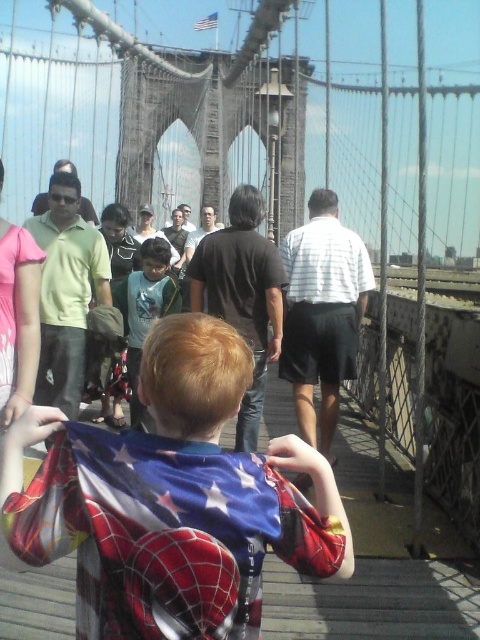
Who is shorter, spiderman costume at center or light blue shirt at center?

light blue shirt at center

Can you confirm if spiderman costume at center is positioned to the right of light blue shirt at center?

Yes, spiderman costume at center is to the right of light blue shirt at center.

Where is `spiderman costume at center`? Image resolution: width=480 pixels, height=640 pixels. spiderman costume at center is located at coordinates (170, 493).

This screenshot has width=480, height=640. What do you see at coordinates (144, 310) in the screenshot?
I see `light blue shirt at center` at bounding box center [144, 310].

Is light blue shirt at center to the left of white fabric flag at upper center from the viewer's perspective?

Correct, you'll find light blue shirt at center to the left of white fabric flag at upper center.

Is point (134, 401) in front of point (202, 28)?

Yes, it is.

Identify the location of light blue shirt at center. This screenshot has height=640, width=480. (144, 310).

Between point (167, 378) and point (213, 17), which one is positioned behind?

Point (213, 17)

Does spiderman costume at center have a lesser width compared to white fabric flag at upper center?

No.

Does point (232, 557) come in front of point (207, 22)?

Yes.

The height and width of the screenshot is (640, 480). I want to click on spiderman costume at center, so click(x=170, y=493).